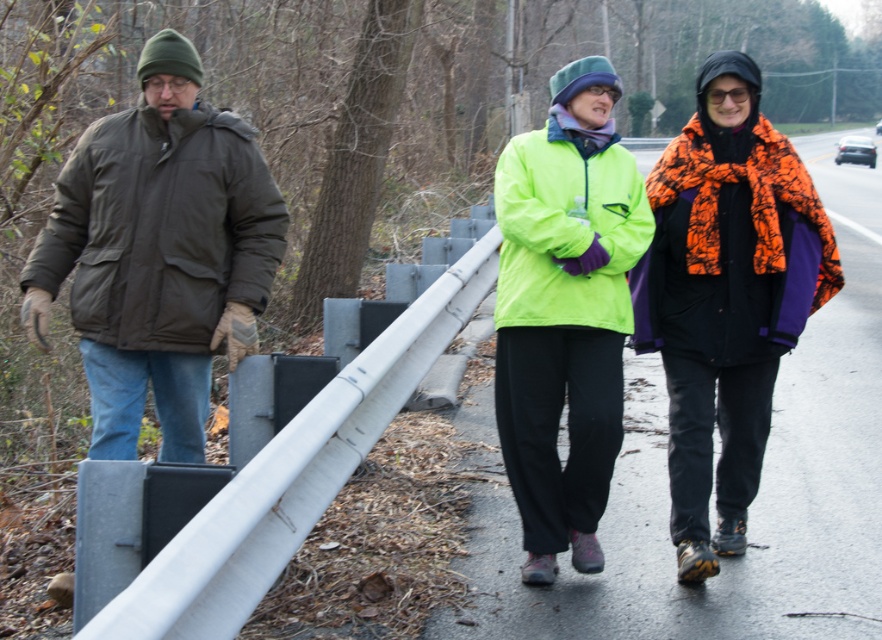
Looking at this image, between dark green puffy jacket at left and orange camouflage jacket at right, which one is positioned higher?

Positioned higher is dark green puffy jacket at left.

Is dark green puffy jacket at left shorter than orange camouflage jacket at right?

Yes, dark green puffy jacket at left is shorter than orange camouflage jacket at right.

Who is more distant from viewer, (79, 211) or (729, 276)?

Positioned behind is point (729, 276).

Image resolution: width=882 pixels, height=640 pixels. I want to click on dark green puffy jacket at left, so click(161, 227).

Does point (502, 234) lie behind point (547, 234)?

Yes, point (502, 234) is behind point (547, 234).

Is point (544, 296) positioned in front of point (589, 220)?

That is True.

Is point (602, 257) farther from camera compared to point (619, 168)?

No, it is in front of (619, 168).

Where is `neon green jacket at center`? The height and width of the screenshot is (640, 882). neon green jacket at center is located at coordinates (564, 310).

Does point (593, 442) come in front of point (756, 198)?

That is True.

Who is higher up, neon green jacket at center or orange camouflage jacket at right?

orange camouflage jacket at right

Which is in front, point (543, 417) or point (786, 228)?

Point (786, 228) is in front.

The height and width of the screenshot is (640, 882). Identify the location of neon green jacket at center. (564, 310).